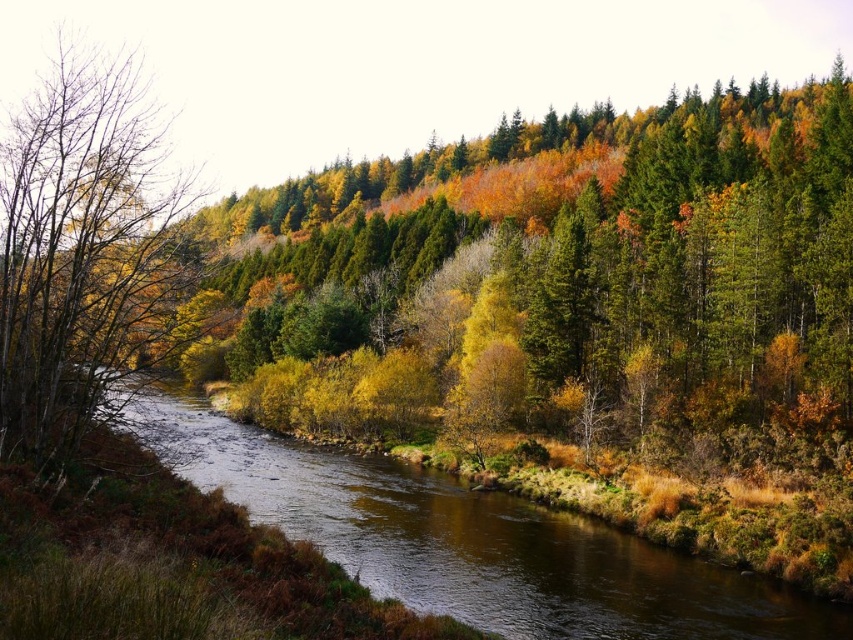
You are standing in the forest and see the brown smooth stream at center and the brown matte tree at left. Which object is positioned to the right of the other?

The brown smooth stream at center is positioned to the right of the brown matte tree at left.

You are a hiker standing at the brown matte tree at left and want to cross the river using the brown smooth stream at center. The stream is 1.2 meters deep. Can you safely cross the stream if you are 1.8 meters tall?

The brown smooth stream at center is 14.59 meters away from the brown matte tree at left. Since the stream is only 1.2 meters deep and you are 1.8 meters tall, you can safely cross the stream as the depth is less than your height.

You are standing at the point marked as point [543,608] and want to walk towards the point marked as point [39,166]. Given that the terrain between them is uneven with possible elevation changes, which direction should you head to reach your destination?

Since point [543,608] is closer to the camera than point [39,166], you should head towards the direction away from you to reach point [39,166].